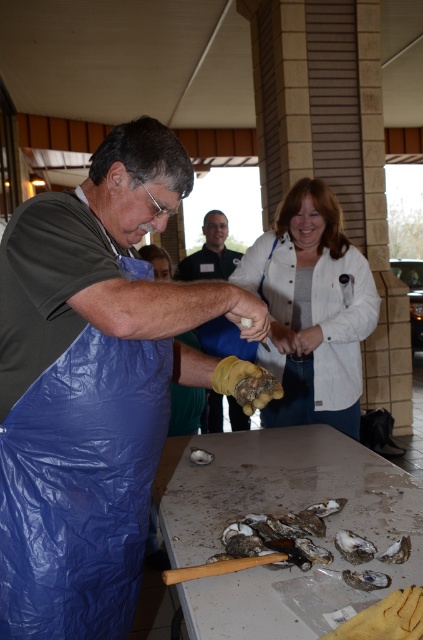
Question: Can you confirm if white shell oyster at center is positioned below yellow rubber glove at center?

Choices:
 (A) no
 (B) yes

Answer: (B)

Question: Which object appears closest to the camera in this image?

Choices:
 (A) white shell oyster at center
 (B) white matte jacket at upper center
 (C) smooth gray oyster at lower center

Answer: (A)

Question: Among these objects, which one is nearest to the camera?

Choices:
 (A) smooth gray oyster at lower center
 (B) white matte jacket at upper center

Answer: (A)

Question: Can you confirm if yellow rubber glove at center is bigger than white matte oyster at center?

Choices:
 (A) no
 (B) yes

Answer: (B)

Question: Among these points, which one is farthest from the camera?

Choices:
 (A) (370, 582)
 (B) (348, 332)
 (C) (340, 536)
 (D) (238, 586)

Answer: (B)

Question: Where is smooth gray oyster at lower center located in relation to smooth white oyster at center in the image?

Choices:
 (A) above
 (B) below

Answer: (A)